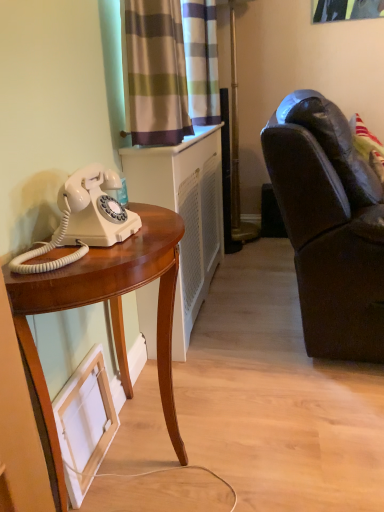
Question: Based on their sizes in the image, would you say dark brown leather couch at right is bigger or smaller than white matte picture frame at lower left?

Choices:
 (A) small
 (B) big

Answer: (B)

Question: Looking at their shapes, would you say dark brown leather couch at right is wider or thinner than white matte picture frame at lower left?

Choices:
 (A) wide
 (B) thin

Answer: (A)

Question: Estimate the real-world distances between objects in this image. Which object is closer to the striped fabric curtain at upper center, acting as the first curtain starting from the front?

Choices:
 (A) white plastic radiator at center
 (B) striped fabric curtain at upper center, positioned as the 1th curtain in back-to-front order
 (C) white glossy rotary phone at left
 (D) dark brown leather couch at right
 (E) mahogany wood desk at left

Answer: (B)

Question: Which is nearer to the white plastic radiator at center?

Choices:
 (A) striped fabric curtain at upper center, positioned as the second curtain in back-to-front order
 (B) white glossy rotary phone at left
 (C) dark brown leather couch at right
 (D) striped fabric curtain at upper center, arranged as the 2th curtain when viewed from the front
 (E) mahogany wood desk at left

Answer: (D)